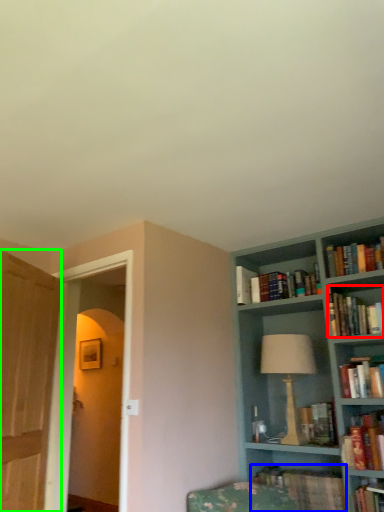
Question: Which object is positioned farthest from book (highlighted by a red box)? Select from book (highlighted by a blue box) and glass door (highlighted by a green box).

Choices:
 (A) book
 (B) glass door

Answer: (B)